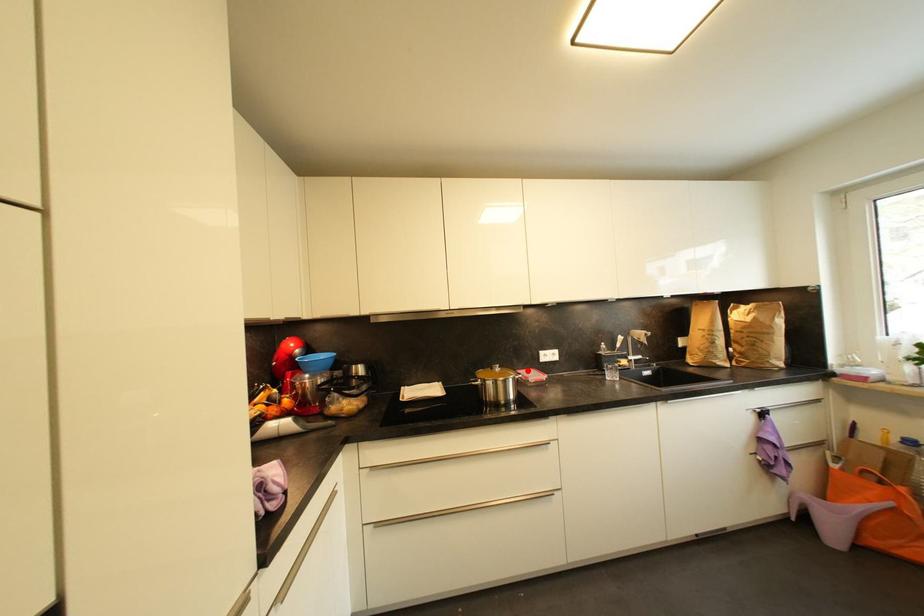
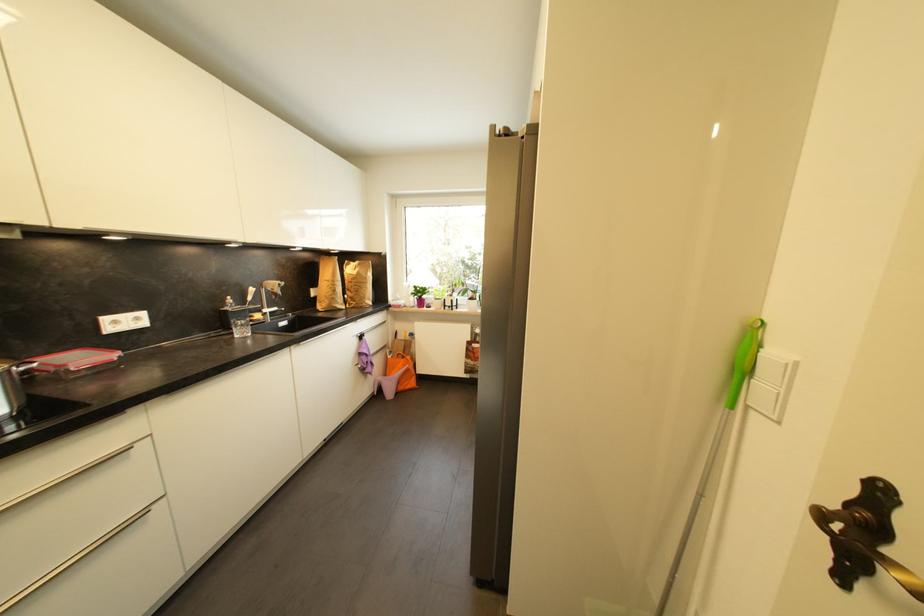
In the second image, find the point that corresponds to the highlighted location in the first image.

(54, 355)